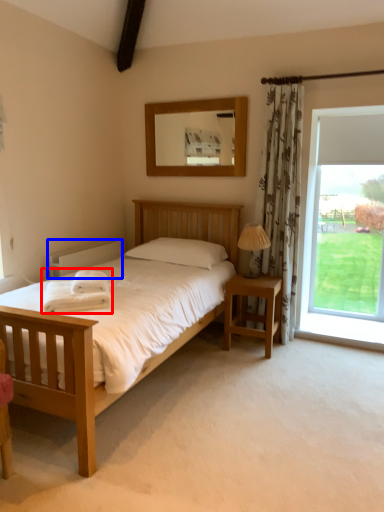
Question: Which object appears closest to the camera in this image, blanket (highlighted by a red box) or radiator (highlighted by a blue box)?

Choices:
 (A) blanket
 (B) radiator

Answer: (A)